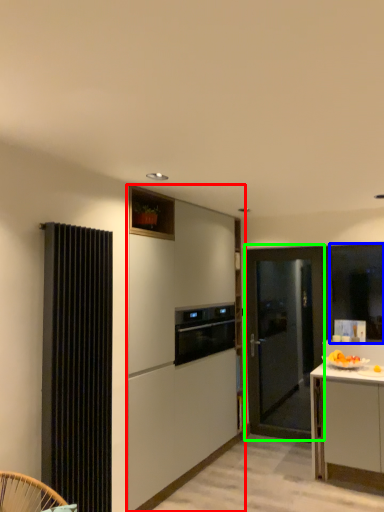
Question: Which object is positioned farthest from cabinetry (highlighted by a red box)? Select from window screen (highlighted by a blue box) and door (highlighted by a green box).

Choices:
 (A) window screen
 (B) door

Answer: (A)